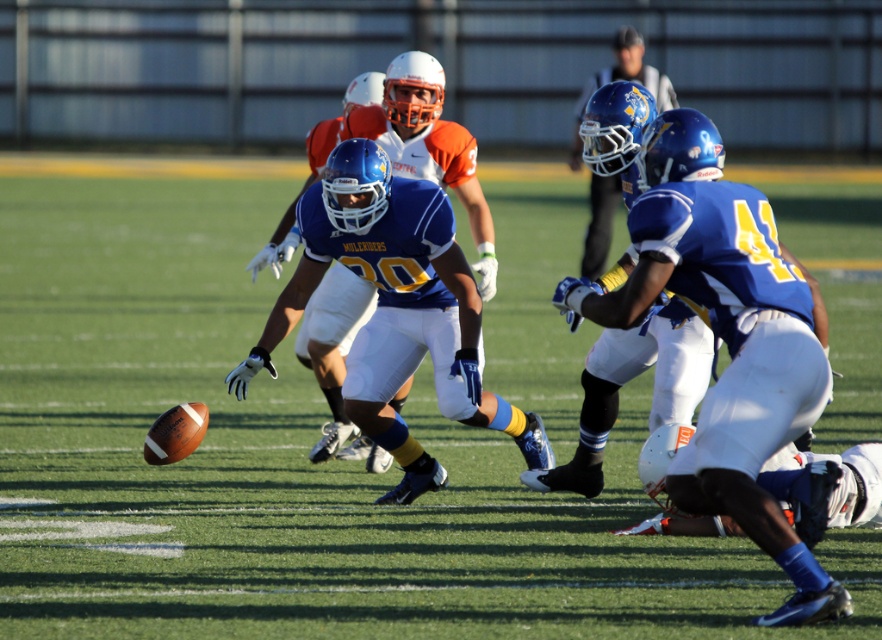
Question: Which point appears closest to the camera in this image?

Choices:
 (A) (587, 269)
 (B) (684, 301)

Answer: (B)

Question: Among these points, which one is nearest to the camera?

Choices:
 (A) (761, 340)
 (B) (611, 209)
 (C) (400, 67)

Answer: (A)

Question: Does matte blue jersey at center appear on the left side of blue matte uniform at center?

Choices:
 (A) no
 (B) yes

Answer: (A)

Question: Is blue matte uniform at center positioned at the back of blue matte helmet at upper center?

Choices:
 (A) no
 (B) yes

Answer: (B)

Question: Which of the following is the closest to the observer?

Choices:
 (A) coord(653,129)
 (B) coord(415,68)

Answer: (A)

Question: Considering the relative positions of matte blue jersey at center and blue matte uniform at center in the image provided, where is matte blue jersey at center located with respect to blue matte uniform at center?

Choices:
 (A) left
 (B) right

Answer: (B)